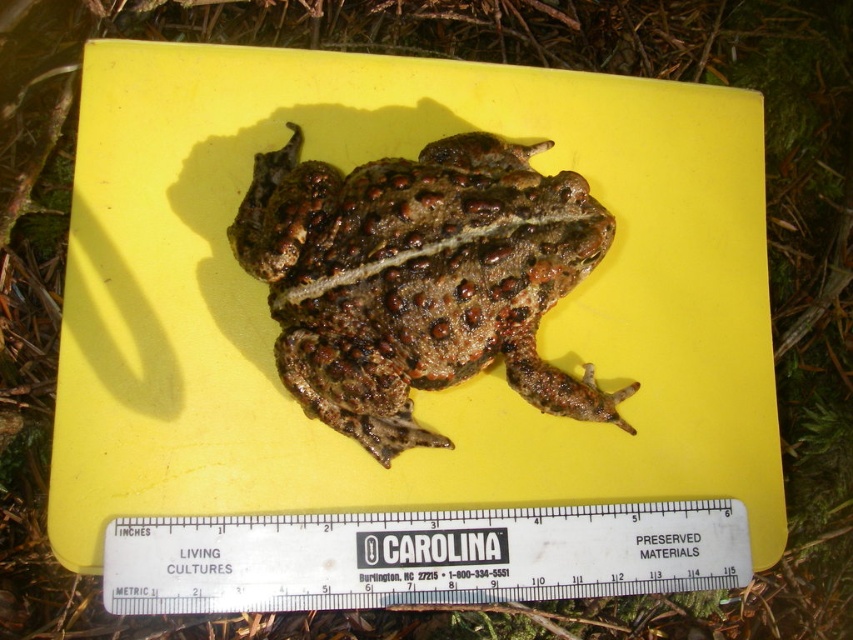
Measure the distance from spotted brown skin at center to white plastic ruler at center.

spotted brown skin at center is 35.94 centimeters away from white plastic ruler at center.

Is spotted brown skin at center bigger than white plastic ruler at center?

Yes, spotted brown skin at center is bigger than white plastic ruler at center.

Does point (339, 358) come farther from viewer compared to point (450, 550)?

That is False.

Locate an element on the screen. spotted brown skin at center is located at coordinates (419, 280).